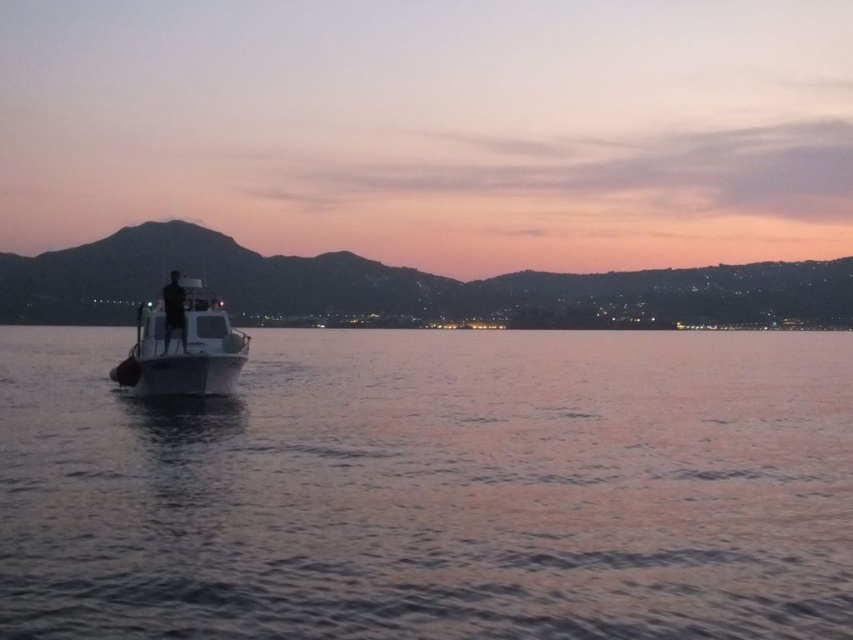
You are standing on the shore looking out at the scene. There is a smooth water at boat left and a white glossy boat at center. Which object is closer to you?

The smooth water at boat left is closer to you because it is in front of the white glossy boat at center.

You are an observer standing on the boat. Looking around, you notice the smooth water at boat left and the white glossy boat at center. Which object takes up more space in your view?

The smooth water at boat left takes up more space in the view because it is larger in size than the white glossy boat at center.